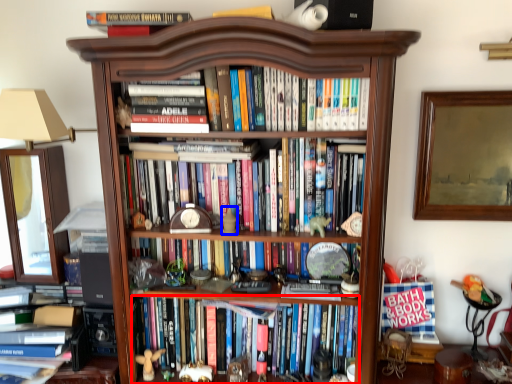
Question: Which object is closer to the camera taking this photo, book (highlighted by a red box) or toy (highlighted by a blue box)?

Choices:
 (A) book
 (B) toy

Answer: (B)